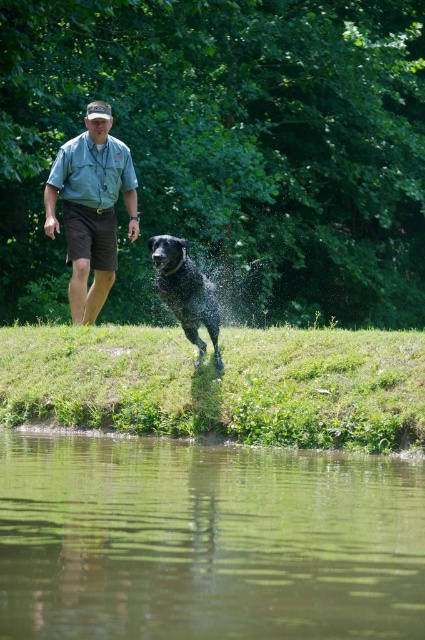
Which is above, greenish-brown water at lower center or shiny black dog at center?

Positioned higher is shiny black dog at center.

Between point (166, 576) and point (181, 237), which one is positioned behind?

The point (181, 237) is more distant.

At what (x,y) coordinates should I click in order to perform the action: click on greenish-brown water at lower center. Please return your answer as a coordinate pair (x, y). Image resolution: width=425 pixels, height=640 pixels. Looking at the image, I should click on (206, 541).

In order to click on greenish-brown water at lower center in this screenshot , I will do `click(206, 541)`.

Is the position of denim shirt at left less distant than that of shiny black dog at center?

No, it is behind shiny black dog at center.

Find the location of `denim shirt at left`. denim shirt at left is located at coordinates (90, 208).

At what (x,y) coordinates should I click in order to perform the action: click on denim shirt at left. Please return your answer as a coordinate pair (x, y). This screenshot has height=640, width=425. Looking at the image, I should click on (90, 208).

Between point (138, 556) and point (108, 289), which one is positioned behind?

The point (108, 289) is more distant.

Who is positioned more to the right, greenish-brown water at lower center or denim shirt at left?

greenish-brown water at lower center is more to the right.

Locate an element on the screen. greenish-brown water at lower center is located at coordinates (206, 541).